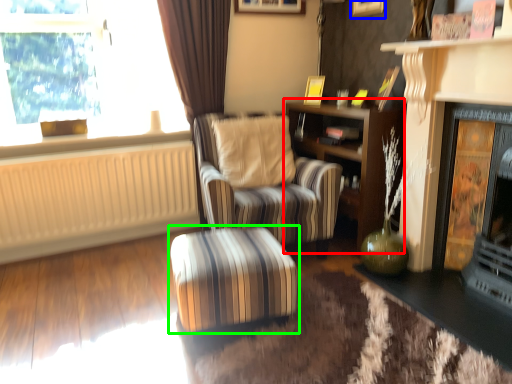
Question: Considering the real-world distances, which object is farthest from shelf (highlighted by a red box)? picture frame (highlighted by a blue box) or table (highlighted by a green box)?

Choices:
 (A) picture frame
 (B) table

Answer: (B)